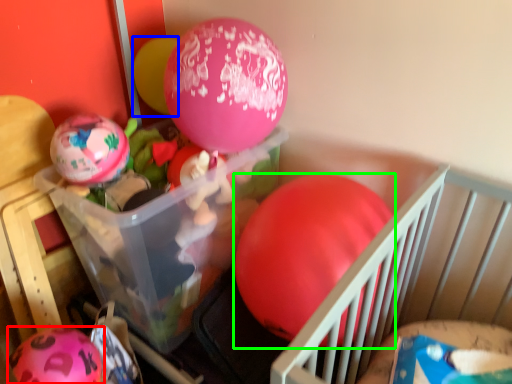
Question: Considering the real-world distances, which object is farthest from balloon (highlighted by a red box)? balloon (highlighted by a blue box) or balloon (highlighted by a green box)?

Choices:
 (A) balloon
 (B) balloon

Answer: (A)